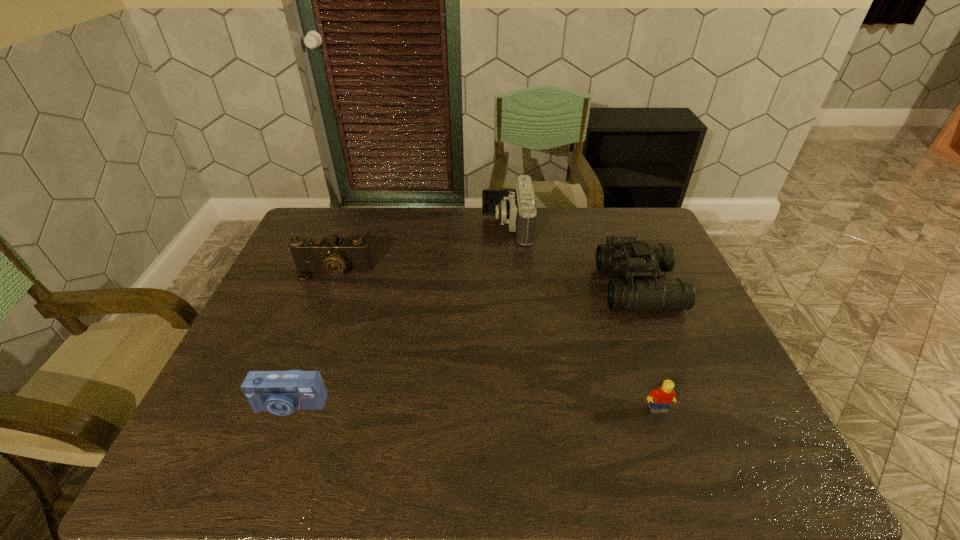
Where is `free space between the Lego and the binoculars`? Image resolution: width=960 pixels, height=540 pixels. free space between the Lego and the binoculars is located at coordinates (648, 348).

I want to click on the second closest object to the Lego, so click(x=517, y=208).

Locate an element on the screen. The height and width of the screenshot is (540, 960). the third closest object to the nearest camera is located at coordinates (661, 398).

Select which camera appears as the closest to the second shortest camera. Please provide its 2D coordinates. Your answer should be formatted as a tuple, i.e. [(x, y)], where the tuple contains the x and y coordinates of a point satisfying the conditions above.

[(517, 208)]

Select which camera appears as the closest to the binoculars. Please provide its 2D coordinates. Your answer should be formatted as a tuple, i.e. [(x, y)], where the tuple contains the x and y coordinates of a point satisfying the conditions above.

[(517, 208)]

Locate an element on the screen. Image resolution: width=960 pixels, height=540 pixels. free location that satisfies the following two spatial constraints: 1. at the front of the farthest camera with an open lens cover; 2. on the lens of the shortest camera is located at coordinates pos(521,405).